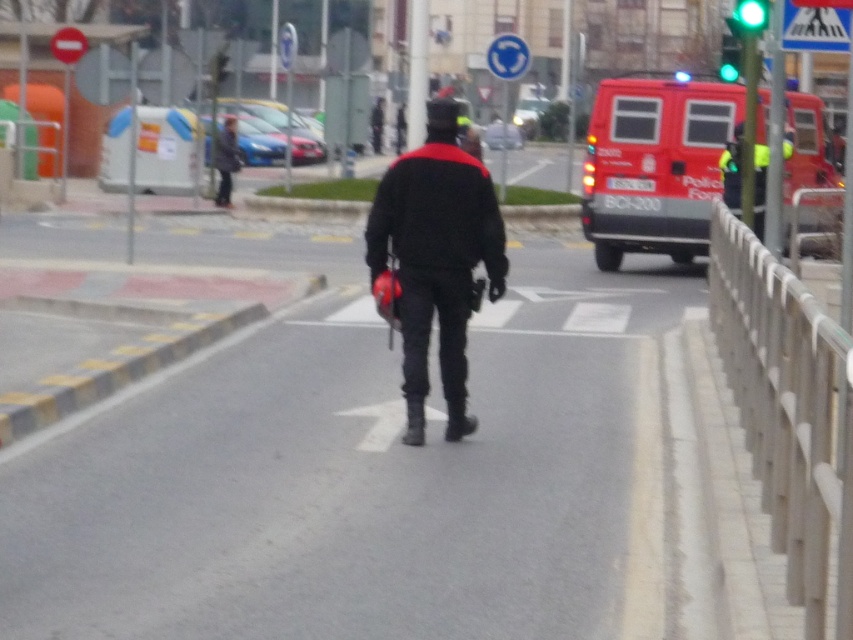
In the scene shown: You are a pedestrian on the sidewalk and see both the reflective yellow vest at right and the dark gray fabric jacket at upper left. Which one is located to the right side of the other?

The reflective yellow vest at right is positioned on the right side of the dark gray fabric jacket at upper left.

You are standing at the point labeled point [221,147] and want to walk to the point labeled point [753,173]. Which direction should you face to move towards your destination?

Since point [753,173] is closer to the viewer than point [221,147], you should face away from the viewer to move towards your destination.